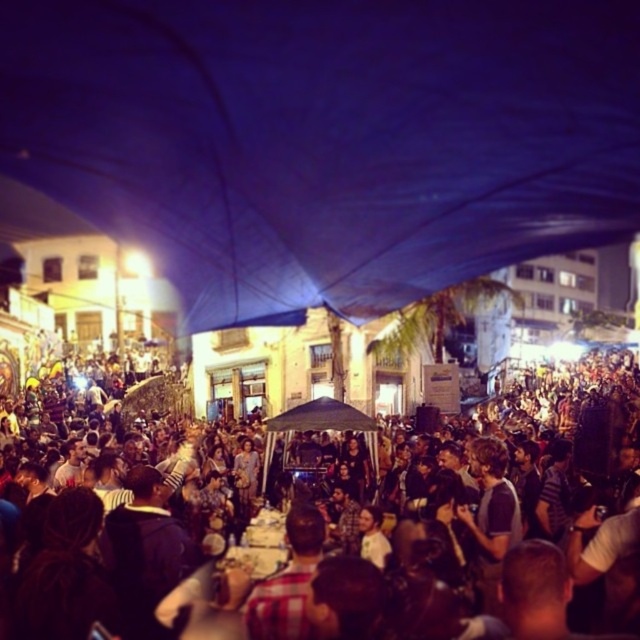
You are an event organizer planning to install a new decorative banner. The banner requires a space wider than the blue fabric canopy at upper center. Can the multicolored fabric crowd at center provide enough width for the banner?

The blue fabric canopy at upper center is narrower than the multicolored fabric crowd at center. Since the banner needs a space wider than the canopy, the multicolored fabric crowd at center has sufficient width to accommodate the banner.

You are a photographer at the event and want to capture a photo of the blue fabric canopy at upper center without the multicolored fabric crowd at center blocking it. Is this possible given their positions?

The multicolored fabric crowd at center is behind the blue fabric canopy at upper center, so the canopy will not be blocked by the crowd. You can capture the photo without obstruction.

You are a photographer at the event and want to capture a photo that includes both the blue fabric canopy at upper center and the multicolored fabric crowd at center. Given the distance between them, is it possible to fit both in the frame of your camera without moving closer or farther away?

The blue fabric canopy at upper center and multicolored fabric crowd at center are 46.77 meters apart. Since the distance between them is quite large, it might be challenging to fit both in the camera frame without adjusting the camera position or zoom level. However, using a wide angle lens could potentially capture both elements in the same shot.